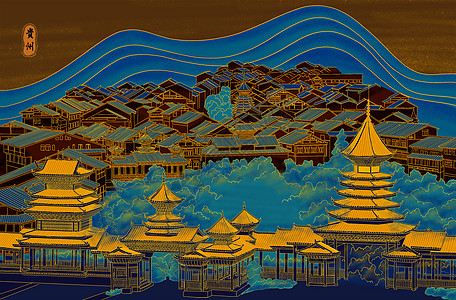
At what (x,y) coordinates should I click in order to perform the action: click on brown plaque. Please return your answer as a coordinate pair (x, y). Looking at the image, I should click on (30, 38).